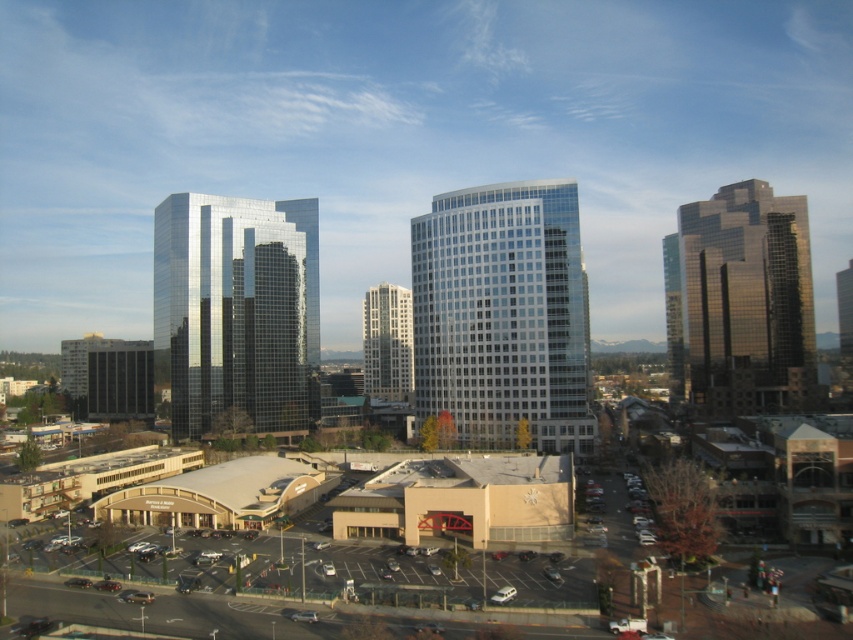
You are a drone operator who needs to fly a drone between the clear glass building at center and the gold reflective glass building at right. The drone has a wingspan of 1.5 meters. Based on the scene, can the drone safely pass through the space between them?

The distance between the clear glass building at center and the gold reflective glass building at right is 171.44 feet, which is more than enough for the drone with a 1.5 meter wingspan to safely pass through.

You are a city planner reviewing this urban layout. You need to determine the vertical positioning of the clear glass building at center and the glassy reflective building at center. Based on the scene, which one is situated higher up in the image?

The clear glass building at center is situated higher up in the image compared to the glassy reflective building at center, as it is positioned above it.